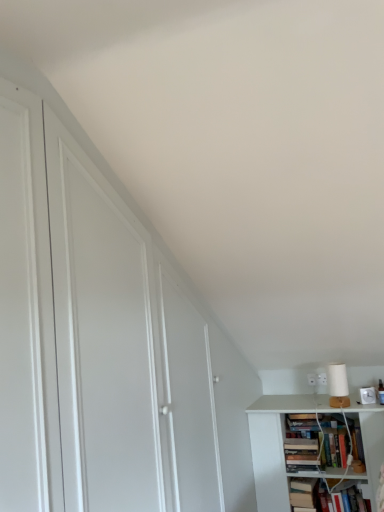
Question: From a real-world perspective, is white matte lamp at upper right over hardcover book at lower right, which is the first book in left-to-right order?

Choices:
 (A) no
 (B) yes

Answer: (B)

Question: Is white matte lamp at upper right positioned in front of hardcover book at lower right, the second book when ordered from right to left?

Choices:
 (A) no
 (B) yes

Answer: (A)

Question: From the image's perspective, is white matte lamp at upper right above hardcover book at lower right, the second book when ordered from right to left?

Choices:
 (A) no
 (B) yes

Answer: (B)

Question: Is hardcover book at lower right, which is the first book in left-to-right order, at the back of white matte lamp at upper right?

Choices:
 (A) yes
 (B) no

Answer: (B)

Question: Considering the relative positions of white matte lamp at upper right and hardcover book at lower right, the second book when ordered from right to left, in the image provided, is white matte lamp at upper right to the right of hardcover book at lower right, the second book when ordered from right to left, from the viewer's perspective?

Choices:
 (A) no
 (B) yes

Answer: (B)

Question: Is white matte lamp at upper right in contact with hardcover book at lower right, which is the first book in left-to-right order?

Choices:
 (A) no
 (B) yes

Answer: (A)

Question: Considering the relative sizes of hardcover book at lower right, which ranks as the second book in left-to-right order, and hardcover book at lower right, the second book when ordered from right to left, in the image provided, is hardcover book at lower right, which ranks as the second book in left-to-right order, wider than hardcover book at lower right, the second book when ordered from right to left,?

Choices:
 (A) no
 (B) yes

Answer: (A)

Question: Is hardcover book at lower right, which is the first book in left-to-right order, surrounded by hardcover book at lower right, which ranks as the second book in left-to-right order?

Choices:
 (A) no
 (B) yes

Answer: (A)

Question: Is hardcover book at lower right, which is counted as the first book, starting from the right, completely or partially outside of hardcover book at lower right, which is the first book in left-to-right order?

Choices:
 (A) no
 (B) yes

Answer: (B)

Question: Is hardcover book at lower right, which ranks as the second book in left-to-right order, smaller than hardcover book at lower right, the second book when ordered from right to left?

Choices:
 (A) no
 (B) yes

Answer: (A)

Question: Considering the relative sizes of hardcover book at lower right, which is counted as the first book, starting from the right, and hardcover book at lower right, the second book when ordered from right to left, in the image provided, is hardcover book at lower right, which is counted as the first book, starting from the right, taller than hardcover book at lower right, the second book when ordered from right to left,?

Choices:
 (A) yes
 (B) no

Answer: (B)

Question: Is hardcover book at lower right, which ranks as the second book in left-to-right order, at the left side of hardcover book at lower right, the second book when ordered from right to left?

Choices:
 (A) no
 (B) yes

Answer: (A)

Question: From the image's perspective, would you say hardcover book at lower right, the second book when ordered from right to left, is shown under white matte lamp at upper right?

Choices:
 (A) yes
 (B) no

Answer: (A)